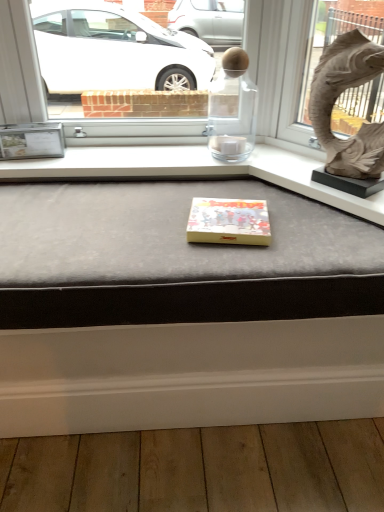
Identify the location of matte gray cushion at center. (179, 306).

Image resolution: width=384 pixels, height=512 pixels. Describe the element at coordinates (229, 222) in the screenshot. I see `yellow matte box at center` at that location.

Image resolution: width=384 pixels, height=512 pixels. I want to click on matte gray cushion at center, so click(x=179, y=306).

Which object is wider, matte gray cushion at center or matte stone animal at upper right?

With larger width is matte gray cushion at center.

Is the surface of matte gray cushion at center in direct contact with matte stone animal at upper right?

They are not placed beside each other.

Who is shorter, matte stone animal at upper right or yellow matte box at center?

Standing shorter between the two is yellow matte box at center.

Considering the sizes of matte stone animal at upper right and yellow matte box at center in the image, is matte stone animal at upper right wider or thinner than yellow matte box at center?

In the image, matte stone animal at upper right appears to be more narrow than yellow matte box at center.

In terms of size, does matte stone animal at upper right appear bigger or smaller than yellow matte box at center?

In the image, matte stone animal at upper right appears to be larger than yellow matte box at center.

Can you tell me how much matte gray cushion at center and yellow matte box at center differ in facing direction?

The facing directions of matte gray cushion at center and yellow matte box at center are 9.68 degrees apart.

Does point (200, 328) appear closer or farther from the camera than point (237, 226)?

Clearly, point (200, 328) is more distant from the camera than point (237, 226).

Is matte gray cushion at center at the left side of yellow matte box at center?

Yes, matte gray cushion at center is to the left of yellow matte box at center.

Considering the positions of objects matte gray cushion at center and yellow matte box at center in the image provided, who is behind, matte gray cushion at center or yellow matte box at center?

yellow matte box at center is behind.

Is yellow matte box at center with matte stone animal at upper right?

No.

Which is behind, point (222, 222) or point (364, 165)?

The point (364, 165) is more distant.

Is the depth of yellow matte box at center less than that of matte stone animal at upper right?

No, yellow matte box at center is further to the viewer.

Could you tell me if yellow matte box at center is turned towards matte stone animal at upper right?

No, yellow matte box at center is not turned towards matte stone animal at upper right.

From their relative heights in the image, would you say matte stone animal at upper right is taller or shorter than matte gray cushion at center?

matte stone animal at upper right is taller than matte gray cushion at center.

The height and width of the screenshot is (512, 384). I want to click on animal sculpture above the matte gray cushion at center (from the image's perspective), so click(336, 99).

Between matte stone animal at upper right and matte gray cushion at center, which one appears on the left side from the viewer's perspective?

matte gray cushion at center is more to the left.

In terms of width, does matte stone animal at upper right look wider or thinner when compared to matte gray cushion at center?

matte stone animal at upper right is thinner than matte gray cushion at center.

Does yellow matte box at center appear on the right side of matte gray cushion at center?

Yes, yellow matte box at center is to the right of matte gray cushion at center.

Can you confirm if yellow matte box at center is wider than matte gray cushion at center?

In fact, yellow matte box at center might be narrower than matte gray cushion at center.

Is yellow matte box at center beside matte gray cushion at center?

No, yellow matte box at center is not making contact with matte gray cushion at center.

Is yellow matte box at center taller than matte gray cushion at center?

In fact, yellow matte box at center may be shorter than matte gray cushion at center.

You are a GUI agent. You are given a task and a screenshot of the screen. Output one action in this format:
    pyautogui.click(x=<x>, y=<y>)
    Task: Click on the animal sculpture positioned vertically above the matte gray cushion at center (from a real-world perspective)
    
    Given the screenshot: What is the action you would take?
    pyautogui.click(x=336, y=99)

This screenshot has height=512, width=384. I want to click on box behind the matte stone animal at upper right, so click(229, 222).

Which object lies nearer to the anchor point matte stone animal at upper right, yellow matte box at center or matte gray cushion at center?

yellow matte box at center is closer to matte stone animal at upper right.

From the image, which object appears to be farther from matte gray cushion at center, matte stone animal at upper right or yellow matte box at center?

matte stone animal at upper right is positioned further to the anchor matte gray cushion at center.

From the image, which object appears to be farther from yellow matte box at center, matte stone animal at upper right or matte gray cushion at center?

Based on the image, matte stone animal at upper right appears to be further to yellow matte box at center.

From the image, which object appears to be farther from matte stone animal at upper right, matte gray cushion at center or yellow matte box at center?

Among the two, matte gray cushion at center is located further to matte stone animal at upper right.

Considering their positions, is yellow matte box at center positioned further to matte gray cushion at center than matte stone animal at upper right?

matte stone animal at upper right is further to matte gray cushion at center.

Estimate the real-world distances between objects in this image. Which object is closer to yellow matte box at center, matte gray cushion at center or matte stone animal at upper right?

matte gray cushion at center.

Find the location of a particular element. The width and height of the screenshot is (384, 512). box situated between matte gray cushion at center and matte stone animal at upper right from left to right is located at coordinates [x=229, y=222].